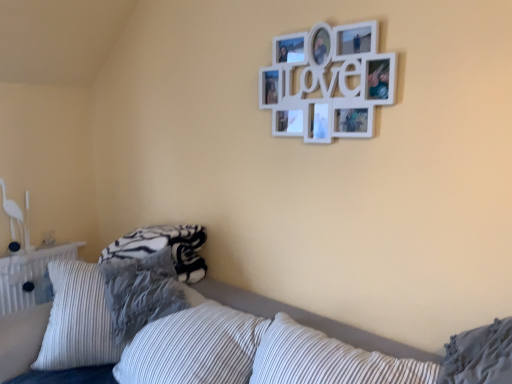
Where is `free space above white matte picture frame at upper center (from a real-world perspective)`? This screenshot has width=512, height=384. free space above white matte picture frame at upper center (from a real-world perspective) is located at coordinates (328, 19).